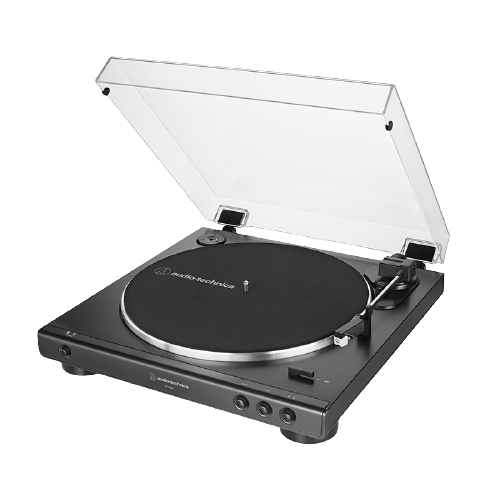
Where is `hinge`? hinge is located at coordinates (224, 221).